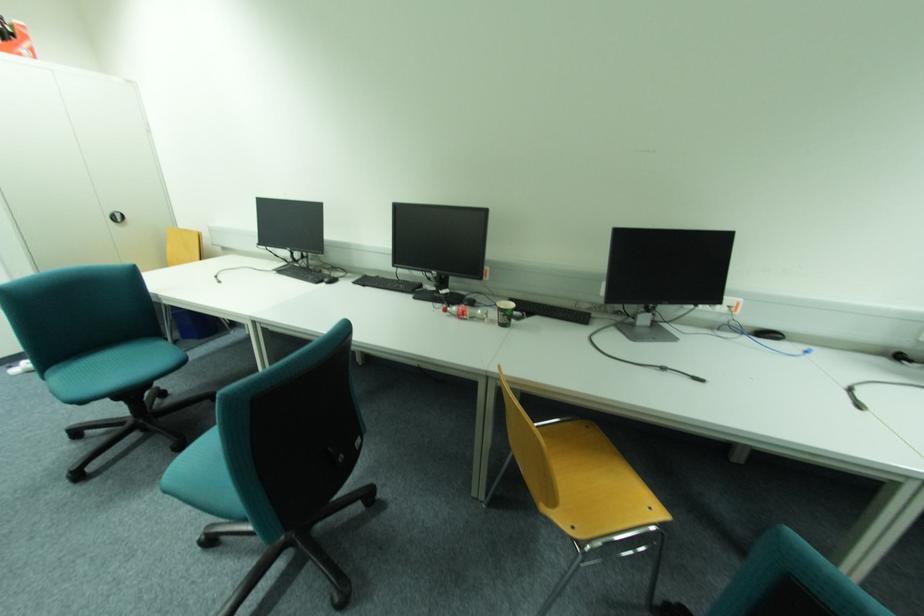
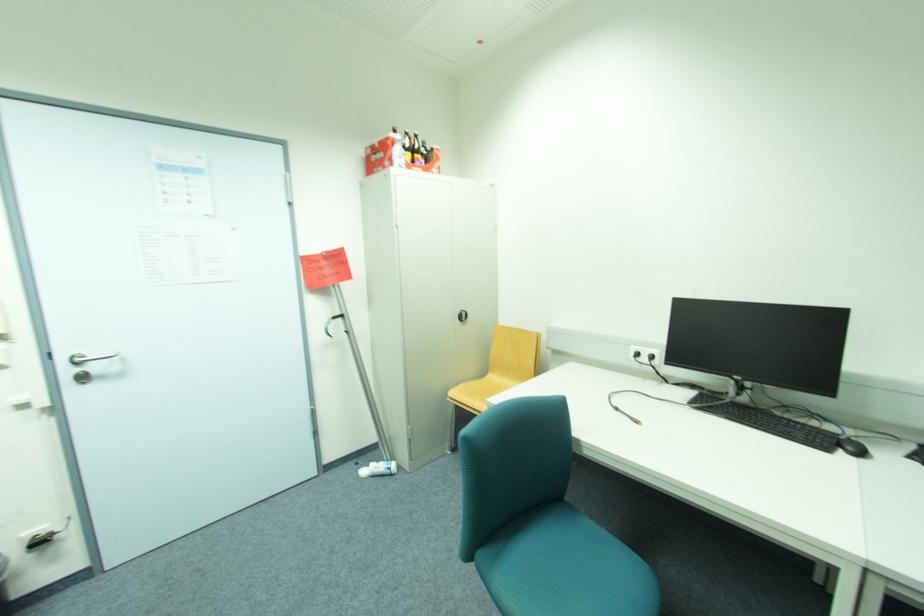
Find the pixel in the second image that matches the point at 27,365 in the first image.

(373, 468)